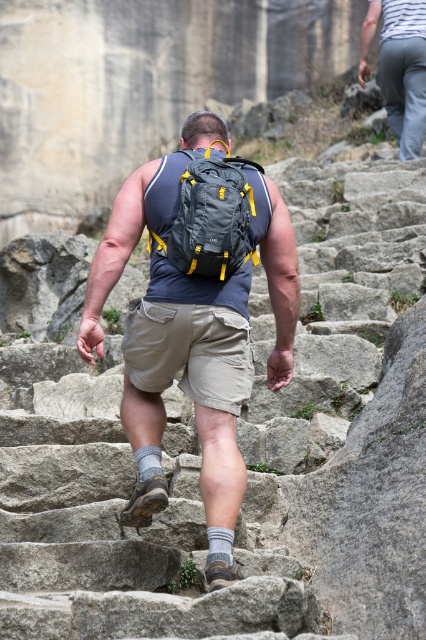
This screenshot has height=640, width=426. Describe the element at coordinates (207, 214) in the screenshot. I see `gray fabric backpack at center` at that location.

Does point (244, 205) come behind point (385, 80)?

No.

Locate an element on the screen. This screenshot has height=640, width=426. gray fabric backpack at center is located at coordinates (207, 214).

From the picture: Does matte black backpack at center lie behind khaki cotton shorts at center?

No, it is in front of khaki cotton shorts at center.

Which of these two, matte black backpack at center or khaki cotton shorts at center, stands shorter?

khaki cotton shorts at center is shorter.

Between point (201, 404) and point (210, 384), which one is positioned behind?

The point (210, 384) is more distant.

In order to click on matte black backpack at center in this screenshot , I will do `click(189, 394)`.

In the scene shown: Is matte black backpack at center behind gray cotton pants at upper right?

No, it is not.

Is matte black backpack at center bigger than gray cotton pants at upper right?

No.

Find the location of a particular element. The height and width of the screenshot is (640, 426). matte black backpack at center is located at coordinates coord(189,394).